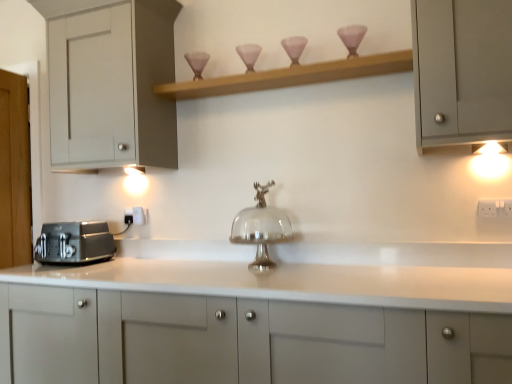
Question: Could you tell me if white matte cabinet at left, which ranks as the 1th cabinetry in top-to-bottom order, is turned towards matte glass candle holder at upper center?

Choices:
 (A) yes
 (B) no

Answer: (B)

Question: Does white matte cabinet at left, which ranks as the 1th cabinetry in top-to-bottom order, have a greater height compared to matte glass candle holder at upper center?

Choices:
 (A) no
 (B) yes

Answer: (B)

Question: Does white matte cabinet at left, which ranks as the 1th cabinetry in top-to-bottom order, appear on the left side of matte glass candle holder at upper center?

Choices:
 (A) no
 (B) yes

Answer: (B)

Question: Considering the relative sizes of white matte cabinet at left, which ranks as the 1th cabinetry in top-to-bottom order, and matte glass candle holder at upper center in the image provided, is white matte cabinet at left, which ranks as the 1th cabinetry in top-to-bottom order, thinner than matte glass candle holder at upper center?

Choices:
 (A) yes
 (B) no

Answer: (B)

Question: Is white matte cabinet at left, which ranks as the 1th cabinetry in top-to-bottom order, positioned far away from matte glass candle holder at upper center?

Choices:
 (A) yes
 (B) no

Answer: (A)

Question: Considering the relative sizes of white matte cabinet at left, placed as the third cabinetry when sorted from bottom to top, and matte glass candle holder at upper center in the image provided, is white matte cabinet at left, placed as the third cabinetry when sorted from bottom to top, bigger than matte glass candle holder at upper center?

Choices:
 (A) yes
 (B) no

Answer: (A)

Question: Considering the relative sizes of wooden shelf at upper center and warm matte light fixture at upper right in the image provided, is wooden shelf at upper center taller than warm matte light fixture at upper right?

Choices:
 (A) no
 (B) yes

Answer: (A)

Question: From the image's perspective, does wooden shelf at upper center appear higher than warm matte light fixture at upper right?

Choices:
 (A) yes
 (B) no

Answer: (A)

Question: From the image's perspective, is wooden shelf at upper center located beneath warm matte light fixture at upper right?

Choices:
 (A) yes
 (B) no

Answer: (B)

Question: Does wooden shelf at upper center come in front of warm matte light fixture at upper right?

Choices:
 (A) no
 (B) yes

Answer: (B)

Question: Considering the relative sizes of wooden shelf at upper center and warm matte light fixture at upper right in the image provided, is wooden shelf at upper center thinner than warm matte light fixture at upper right?

Choices:
 (A) no
 (B) yes

Answer: (A)

Question: Considering the relative sizes of wooden shelf at upper center and warm matte light fixture at upper right in the image provided, is wooden shelf at upper center bigger than warm matte light fixture at upper right?

Choices:
 (A) yes
 (B) no

Answer: (A)

Question: Would you say white glossy cabinet at center, which ranks as the third cabinetry in top-to-bottom order, is outside wooden shelf at upper center?

Choices:
 (A) no
 (B) yes

Answer: (B)